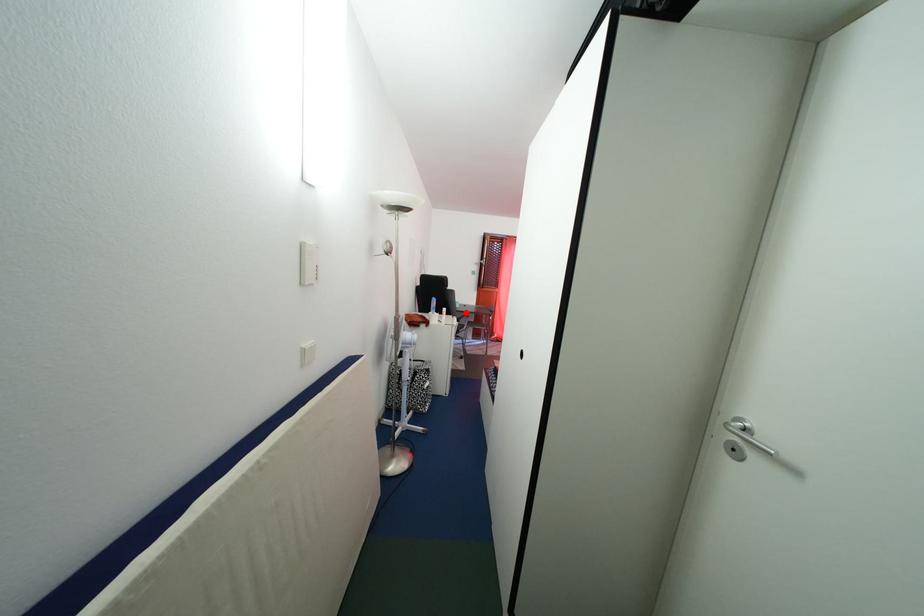
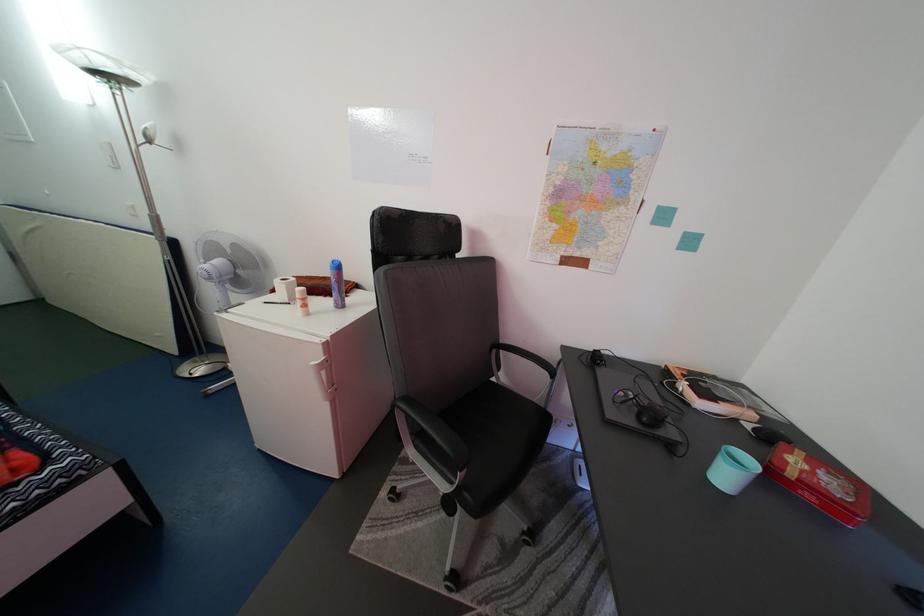
Find the pixel in the second image that matches the highlighted location in the first image.

(735, 484)